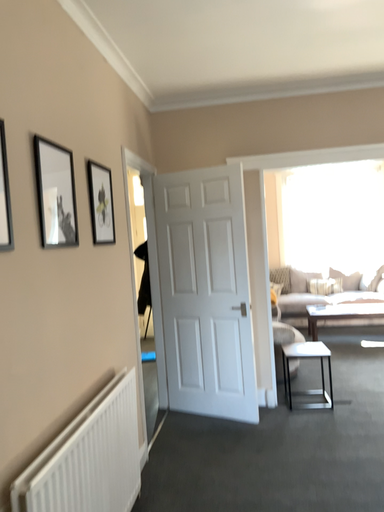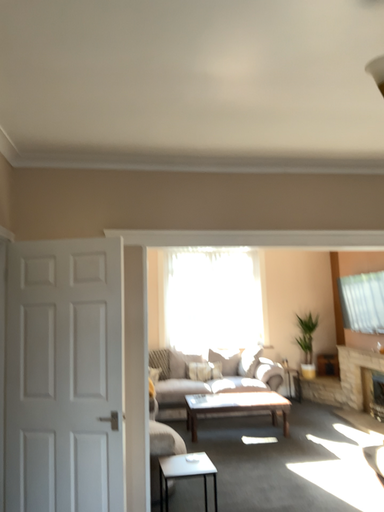
Question: How did the camera likely rotate when shooting the video?

Choices:
 (A) rotated left
 (B) rotated right

Answer: (B)